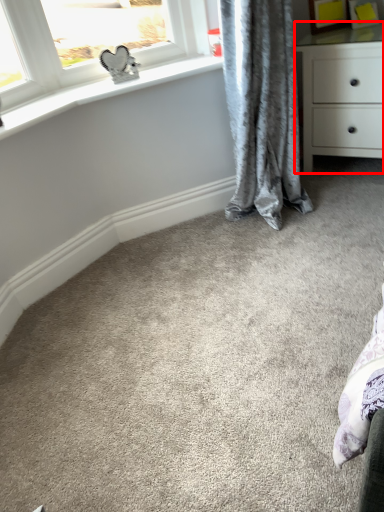
Question: From the image's perspective, where is chest of drawers (annotated by the red box) located in relation to curtain in the image?

Choices:
 (A) above
 (B) below

Answer: (A)